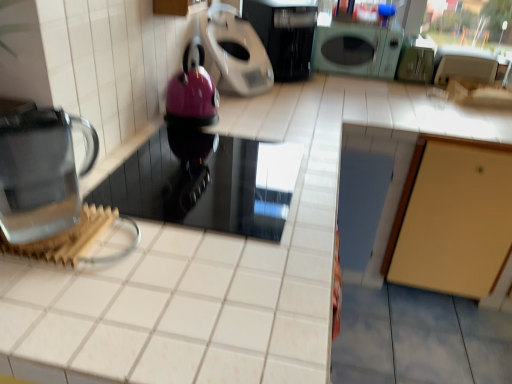
This screenshot has height=384, width=512. Find the location of `transparent glass kettle at left`. transparent glass kettle at left is located at coordinates (40, 170).

You are a GUI agent. You are given a task and a screenshot of the screen. Output one action in this format:
    pyautogui.click(x=<x>, y=<y>)
    Task: Click on the transparent glass kettle at left
    The height and width of the screenshot is (384, 512).
    Given the screenshot: What is the action you would take?
    pyautogui.click(x=40, y=170)

Measure the distance from transparent glass kettle at left to glossy plastic kettle at upper center, the second appliance when ordered from bottom to top.

A distance of 24.02 inches exists between transparent glass kettle at left and glossy plastic kettle at upper center, the second appliance when ordered from bottom to top.

From a real-world perspective, is transparent glass kettle at left on glossy plastic kettle at upper center, positioned as the 1th appliance in top-to-bottom order?

Yes, from a real-world perspective, transparent glass kettle at left is on top of glossy plastic kettle at upper center, positioned as the 1th appliance in top-to-bottom order.

Looking at this image, considering the positions of objects transparent glass kettle at left and glossy plastic kettle at upper center, positioned as the 1th appliance in top-to-bottom order, in the image provided, who is in front, transparent glass kettle at left or glossy plastic kettle at upper center, positioned as the 1th appliance in top-to-bottom order,?

transparent glass kettle at left.

From a real-world perspective, which appliance is the 1st one underneath the transparent glass kettle at left? Please provide its 2D coordinates.

[(192, 92)]

Based on the photo, is transparent glass kettle at left looking in the opposite direction of metallic silver scale at upper center, positioned as the 1th kitchen appliance in left-to-right order?

That's not correct — transparent glass kettle at left is not looking away from metallic silver scale at upper center, positioned as the 1th kitchen appliance in left-to-right order.

How many degrees apart are the facing directions of transparent glass kettle at left and metallic silver scale at upper center, positioned as the 1th kitchen appliance in left-to-right order?

transparent glass kettle at left and metallic silver scale at upper center, positioned as the 1th kitchen appliance in left-to-right order, are facing 27.1 degrees away from each other.

Considering the positions of point (56, 154) and point (204, 37), is point (56, 154) closer or farther from the camera than point (204, 37)?

Point (56, 154) appears to be closer to the viewer than point (204, 37).

This screenshot has height=384, width=512. Find the location of `the 1st kitchen appliance counting from the right of the transparent glass kettle at left`. the 1st kitchen appliance counting from the right of the transparent glass kettle at left is located at coordinates (234, 52).

Which object is positioned more to the right, black glossy microwave at upper center, which is the 1th kitchen appliance in right-to-left order, or metallic silver scale at upper center, positioned as the 1th kitchen appliance in left-to-right order?

Positioned to the right is black glossy microwave at upper center, which is the 1th kitchen appliance in right-to-left order.

From a real-world perspective, is black glossy microwave at upper center, arranged as the second kitchen appliance when viewed from the left, on metallic silver scale at upper center, positioned as the 1th kitchen appliance in left-to-right order?

Yes, from a real-world perspective, black glossy microwave at upper center, arranged as the second kitchen appliance when viewed from the left, is above metallic silver scale at upper center, positioned as the 1th kitchen appliance in left-to-right order.

Consider the image. Which point is more distant from viewer, (263, 26) or (212, 61)?

The point (263, 26) is behind.

Can you confirm if black glossy microwave at upper center, arranged as the second kitchen appliance when viewed from the left, is bigger than metallic silver scale at upper center, which is counted as the second kitchen appliance, starting from the right?

Yes, black glossy microwave at upper center, arranged as the second kitchen appliance when viewed from the left, is bigger than metallic silver scale at upper center, which is counted as the second kitchen appliance, starting from the right.

How much distance is there between glossy plastic kettle at upper center, positioned as the 1th appliance in top-to-bottom order, and transparent glass kettle at left?

glossy plastic kettle at upper center, positioned as the 1th appliance in top-to-bottom order, is 24.02 inches away from transparent glass kettle at left.

This screenshot has height=384, width=512. I want to click on home appliance that appears below the glossy plastic kettle at upper center, the second appliance when ordered from bottom to top (from the image's perspective), so click(x=40, y=170).

Is glossy plastic kettle at upper center, the second appliance when ordered from bottom to top, bigger than transparent glass kettle at left?

Yes, glossy plastic kettle at upper center, the second appliance when ordered from bottom to top, is bigger than transparent glass kettle at left.

Is glossy plastic kettle at upper center, positioned as the 1th appliance in top-to-bottom order, wider or thinner than transparent glass kettle at left?

Clearly, glossy plastic kettle at upper center, positioned as the 1th appliance in top-to-bottom order, has more width compared to transparent glass kettle at left.

Does glossy plastic kettle at upper center, positioned as the 1th appliance in top-to-bottom order, have a lesser width compared to glossy black microwave at center, the first appliance positioned from the bottom?

Indeed, glossy plastic kettle at upper center, positioned as the 1th appliance in top-to-bottom order, has a lesser width compared to glossy black microwave at center, the first appliance positioned from the bottom.

Does glossy plastic kettle at upper center, positioned as the 1th appliance in top-to-bottom order, lie behind glossy black microwave at center, acting as the second appliance starting from the top?

That is True.

From a real-world perspective, is glossy plastic kettle at upper center, positioned as the 1th appliance in top-to-bottom order, physically located above or below glossy black microwave at center, acting as the second appliance starting from the top?

Clearly, from a real-world perspective, glossy plastic kettle at upper center, positioned as the 1th appliance in top-to-bottom order, is above glossy black microwave at center, acting as the second appliance starting from the top.

Is glossy plastic kettle at upper center, positioned as the 1th appliance in top-to-bottom order, next to glossy black microwave at center, acting as the second appliance starting from the top, and touching it?

They are not placed beside each other.

Would you say glossy black microwave at center, the first appliance positioned from the bottom, is inside or outside glossy plastic kettle at upper center, positioned as the 1th appliance in top-to-bottom order?

glossy black microwave at center, the first appliance positioned from the bottom, cannot be found inside glossy plastic kettle at upper center, positioned as the 1th appliance in top-to-bottom order.

In terms of width, does glossy black microwave at center, the first appliance positioned from the bottom, look wider or thinner when compared to glossy plastic kettle at upper center, the second appliance when ordered from bottom to top?

Considering their sizes, glossy black microwave at center, the first appliance positioned from the bottom, looks broader than glossy plastic kettle at upper center, the second appliance when ordered from bottom to top.

Is glossy black microwave at center, the first appliance positioned from the bottom, far from glossy plastic kettle at upper center, the second appliance when ordered from bottom to top?

No, glossy black microwave at center, the first appliance positioned from the bottom, is not far from glossy plastic kettle at upper center, the second appliance when ordered from bottom to top.

Does point (156, 188) lie in front of point (210, 114)?

Yes, it is.

In terms of size, does glossy black microwave at center, the first appliance positioned from the bottom, appear bigger or smaller than transparent glass kettle at left?

glossy black microwave at center, the first appliance positioned from the bottom, is bigger than transparent glass kettle at left.

In the scene shown: From the image's perspective, relative to transparent glass kettle at left, is glossy black microwave at center, acting as the second appliance starting from the top, above or below?

From the image's perspective, glossy black microwave at center, acting as the second appliance starting from the top, appears below transparent glass kettle at left.

From a real-world perspective, who is located lower, glossy black microwave at center, the first appliance positioned from the bottom, or transparent glass kettle at left?

From a 3D spatial view, glossy black microwave at center, the first appliance positioned from the bottom, is below.

Can you see glossy black microwave at center, acting as the second appliance starting from the top, touching transparent glass kettle at left?

No.

Image resolution: width=512 pixels, height=384 pixels. I want to click on home appliance that is in front of the glossy plastic kettle at upper center, the second appliance when ordered from bottom to top, so click(x=40, y=170).

This screenshot has height=384, width=512. I want to click on home appliance lying below the metallic silver scale at upper center, which is counted as the second kitchen appliance, starting from the right (from the image's perspective), so click(40, 170).

Estimate the real-world distances between objects in this image. Which object is closer to metallic silver scale at upper center, which is counted as the second kitchen appliance, starting from the right, transparent glass kettle at left or glossy black microwave at center, the first appliance positioned from the bottom?

glossy black microwave at center, the first appliance positioned from the bottom.

From the picture: Based on their spatial positions, is metallic silver scale at upper center, which is counted as the second kitchen appliance, starting from the right, or glossy plastic kettle at upper center, the second appliance when ordered from bottom to top, further from glossy black microwave at center, the first appliance positioned from the bottom?

Among the two, metallic silver scale at upper center, which is counted as the second kitchen appliance, starting from the right, is located further to glossy black microwave at center, the first appliance positioned from the bottom.

Based on their spatial positions, is black glossy microwave at upper center, arranged as the second kitchen appliance when viewed from the left, or metallic silver scale at upper center, which is counted as the second kitchen appliance, starting from the right, closer to transparent glass kettle at left?

Among the two, metallic silver scale at upper center, which is counted as the second kitchen appliance, starting from the right, is located nearer to transparent glass kettle at left.

Based on their spatial positions, is glossy black microwave at center, the first appliance positioned from the bottom, or metallic silver scale at upper center, positioned as the 1th kitchen appliance in left-to-right order, further from transparent glass kettle at left?

metallic silver scale at upper center, positioned as the 1th kitchen appliance in left-to-right order.

Which object lies nearer to the anchor point transparent glass kettle at left, black glossy microwave at upper center, arranged as the second kitchen appliance when viewed from the left, or glossy plastic kettle at upper center, the second appliance when ordered from bottom to top?

Among the two, glossy plastic kettle at upper center, the second appliance when ordered from bottom to top, is located nearer to transparent glass kettle at left.

In the scene shown: Estimate the real-world distances between objects in this image. Which object is closer to black glossy microwave at upper center, which is the 1th kitchen appliance in right-to-left order, glossy black microwave at center, acting as the second appliance starting from the top, or transparent glass kettle at left?

glossy black microwave at center, acting as the second appliance starting from the top.

Looking at the image, which one is located further to metallic silver scale at upper center, positioned as the 1th kitchen appliance in left-to-right order, glossy plastic kettle at upper center, positioned as the 1th appliance in top-to-bottom order, or transparent glass kettle at left?

transparent glass kettle at left lies further to metallic silver scale at upper center, positioned as the 1th kitchen appliance in left-to-right order, than the other object.

Estimate the real-world distances between objects in this image. Which object is closer to metallic silver scale at upper center, which is counted as the second kitchen appliance, starting from the right, transparent glass kettle at left or glossy plastic kettle at upper center, the second appliance when ordered from bottom to top?

glossy plastic kettle at upper center, the second appliance when ordered from bottom to top, is closer to metallic silver scale at upper center, which is counted as the second kitchen appliance, starting from the right.

The image size is (512, 384). What are the coordinates of `appliance between transparent glass kettle at left and glossy plastic kettle at upper center, positioned as the 1th appliance in top-to-bottom order, along the z-axis` in the screenshot? It's located at (206, 182).

Where is `appliance located between glossy black microwave at center, the first appliance positioned from the bottom, and black glossy microwave at upper center, arranged as the second kitchen appliance when viewed from the left, in the depth direction`? The height and width of the screenshot is (384, 512). appliance located between glossy black microwave at center, the first appliance positioned from the bottom, and black glossy microwave at upper center, arranged as the second kitchen appliance when viewed from the left, in the depth direction is located at coordinates (192, 92).

You are a GUI agent. You are given a task and a screenshot of the screen. Output one action in this format:
    pyautogui.click(x=<x>, y=<y>)
    Task: Click on the kitchen appliance located between glossy black microwave at center, the first appliance positioned from the bottom, and black glossy microwave at upper center, arranged as the second kitchen appliance when viewed from the left, in the depth direction
    
    Given the screenshot: What is the action you would take?
    pyautogui.click(x=234, y=52)

Where is `kitchen appliance between glossy plastic kettle at upper center, positioned as the 1th appliance in top-to-bottom order, and black glossy microwave at upper center, which is the 1th kitchen appliance in right-to-left order, in the front-back direction`? The image size is (512, 384). kitchen appliance between glossy plastic kettle at upper center, positioned as the 1th appliance in top-to-bottom order, and black glossy microwave at upper center, which is the 1th kitchen appliance in right-to-left order, in the front-back direction is located at coordinates (234, 52).